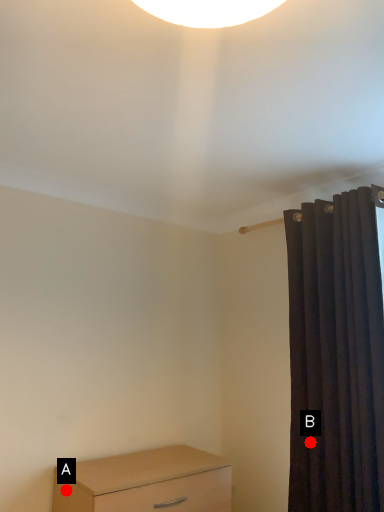
Question: Two points are circled on the image, labeled by A and B beside each circle. Which point appears farthest from the camera in this image?

Choices:
 (A) A is further
 (B) B is further

Answer: (B)